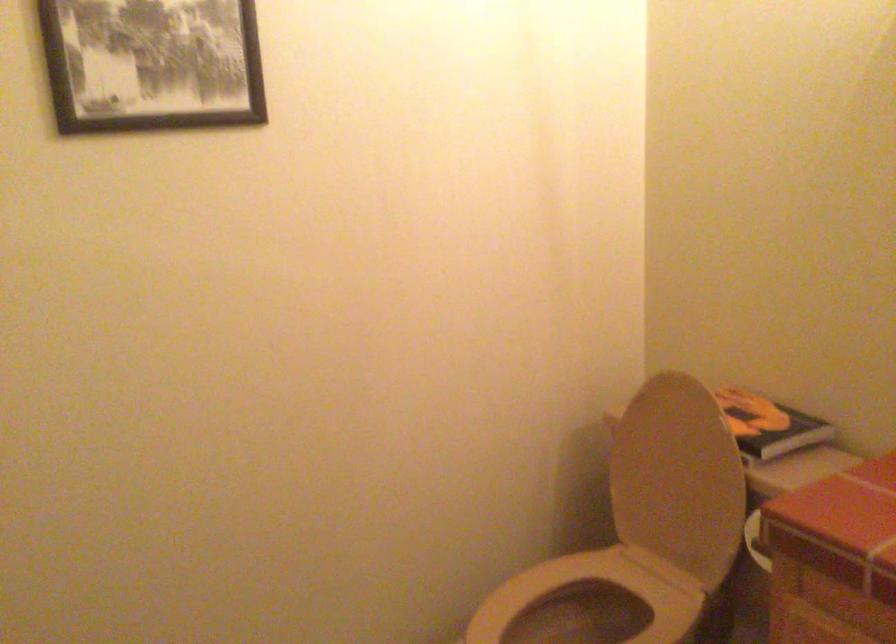
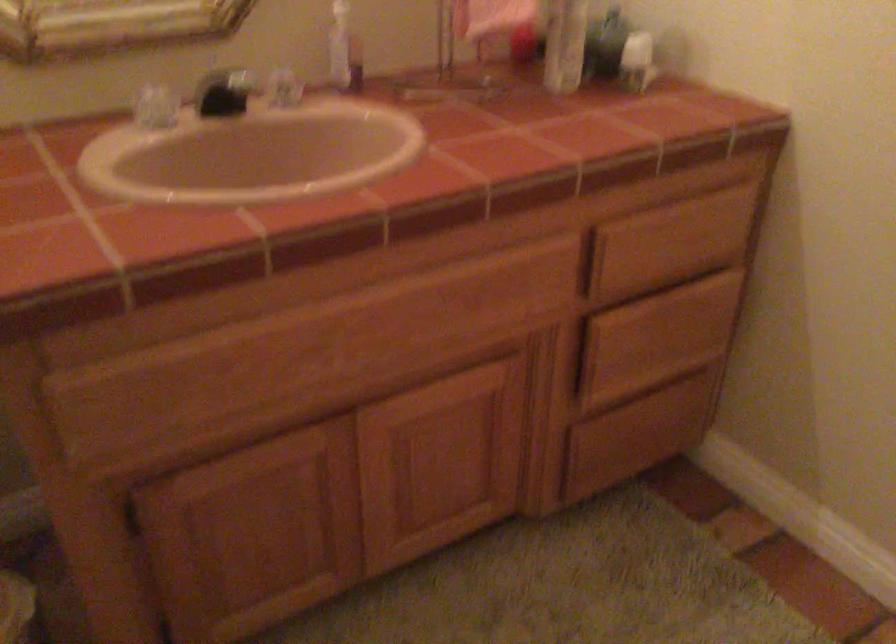
The first image is from the beginning of the video and the second image is from the end. How did the camera likely rotate when shooting the video?

The camera rotated toward right-down.